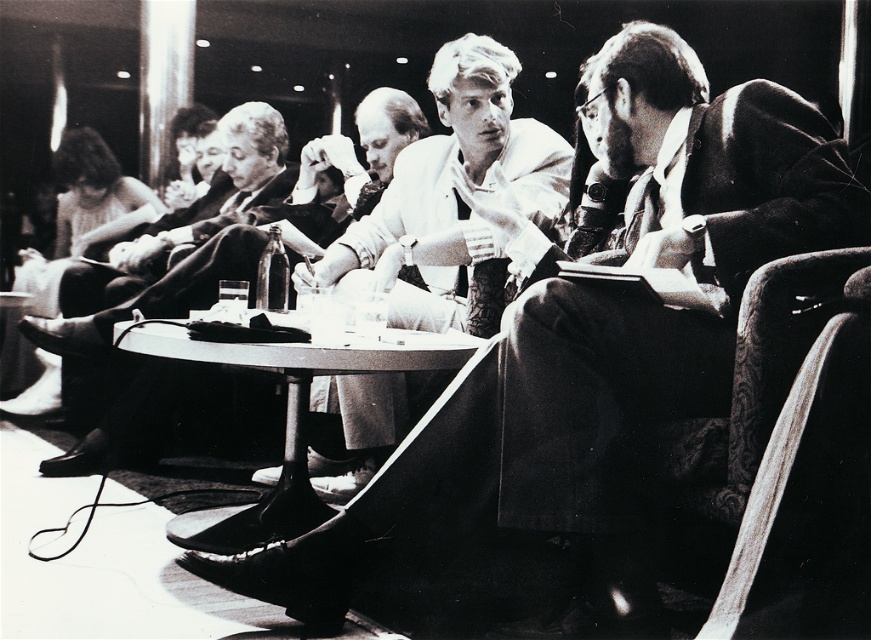
Question: Which point is closer to the camera?

Choices:
 (A) white cotton shirt at center
 (B) smooth plastic table at center

Answer: (B)

Question: Observing the image, what is the correct spatial positioning of smooth leather jacket at center in reference to smooth plastic table at center?

Choices:
 (A) left
 (B) right

Answer: (A)

Question: In this image, where is white cotton shirt at center located relative to smooth plastic table at center?

Choices:
 (A) left
 (B) right

Answer: (B)

Question: Can you confirm if white cotton shirt at center is thinner than smooth leather jacket at center?

Choices:
 (A) yes
 (B) no

Answer: (A)

Question: Among these objects, which one is nearest to the camera?

Choices:
 (A) white cotton shirt at center
 (B) smooth leather jacket at center

Answer: (A)

Question: Which point is farther from the camera taking this photo?

Choices:
 (A) (110, 420)
 (B) (269, 508)

Answer: (A)